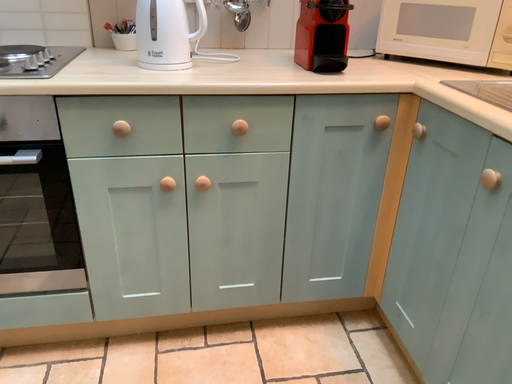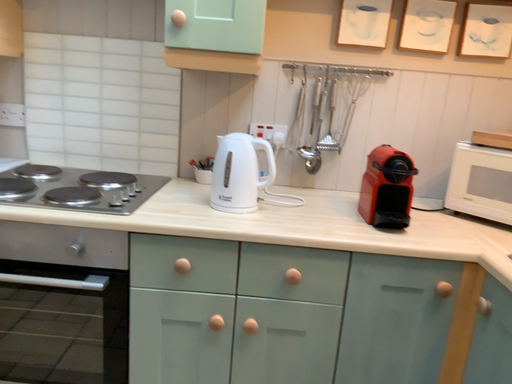
Question: Which way did the camera rotate in the video?

Choices:
 (A) rotated upward
 (B) rotated downward

Answer: (A)